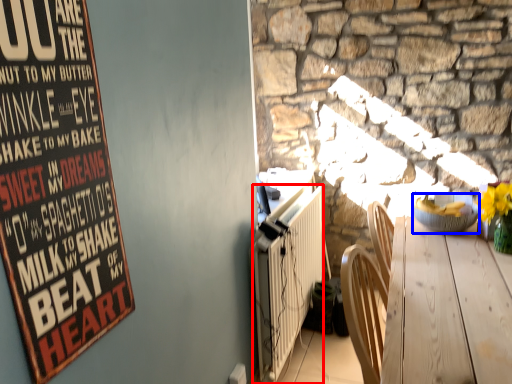
Question: Which of the following is the closest to the observer, radiator (highlighted by a red box) or bowl (highlighted by a blue box)?

Choices:
 (A) radiator
 (B) bowl

Answer: (A)